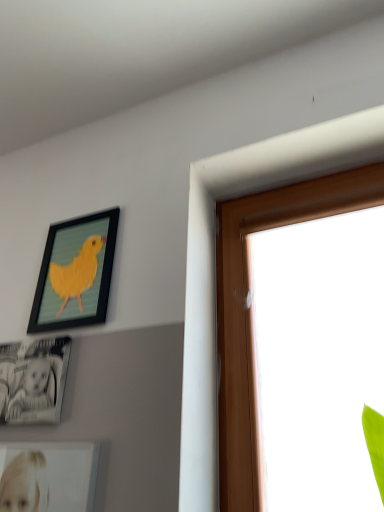
Question: Would you say black glossy photo frame at lower left, which ranks as the 2th picture frame in top-to-bottom order, is outside matte black picture frame at upper left, marked as the 2th picture frame in a bottom-to-top arrangement?

Choices:
 (A) no
 (B) yes

Answer: (B)

Question: Is black glossy photo frame at lower left, which appears as the first picture frame when ordered from the bottom, bigger than matte black picture frame at upper left, marked as the 2th picture frame in a bottom-to-top arrangement?

Choices:
 (A) yes
 (B) no

Answer: (B)

Question: Is black glossy photo frame at lower left, which ranks as the 2th picture frame in top-to-bottom order, taller than matte black picture frame at upper left, marked as the 2th picture frame in a bottom-to-top arrangement?

Choices:
 (A) yes
 (B) no

Answer: (B)

Question: Does black glossy photo frame at lower left, which ranks as the 2th picture frame in top-to-bottom order, appear on the left side of matte black picture frame at upper left, marked as the 2th picture frame in a bottom-to-top arrangement?

Choices:
 (A) no
 (B) yes

Answer: (B)

Question: Is black glossy photo frame at lower left, which ranks as the 2th picture frame in top-to-bottom order, closer to camera compared to matte black picture frame at upper left, the 1th picture frame in the top-to-bottom sequence?

Choices:
 (A) no
 (B) yes

Answer: (B)

Question: Could matte black picture frame at upper left, marked as the 2th picture frame in a bottom-to-top arrangement, be considered to be inside black glossy photo frame at lower left, which ranks as the 2th picture frame in top-to-bottom order?

Choices:
 (A) yes
 (B) no

Answer: (B)

Question: Does matte black picture frame at upper left, the 1th picture frame in the top-to-bottom sequence, have a greater height compared to black glossy photo frame at lower left, which ranks as the 2th picture frame in top-to-bottom order?

Choices:
 (A) no
 (B) yes

Answer: (B)

Question: Is matte black picture frame at upper left, marked as the 2th picture frame in a bottom-to-top arrangement, to the left of black glossy photo frame at lower left, which ranks as the 2th picture frame in top-to-bottom order, from the viewer's perspective?

Choices:
 (A) no
 (B) yes

Answer: (A)

Question: Is matte black picture frame at upper left, the 1th picture frame in the top-to-bottom sequence, thinner than black glossy photo frame at lower left, which appears as the first picture frame when ordered from the bottom?

Choices:
 (A) no
 (B) yes

Answer: (B)

Question: From the image's perspective, is matte black picture frame at upper left, marked as the 2th picture frame in a bottom-to-top arrangement, under black glossy photo frame at lower left, which appears as the first picture frame when ordered from the bottom?

Choices:
 (A) yes
 (B) no

Answer: (B)

Question: Considering the relative sizes of matte black picture frame at upper left, the 1th picture frame in the top-to-bottom sequence, and black glossy photo frame at lower left, which appears as the first picture frame when ordered from the bottom, in the image provided, is matte black picture frame at upper left, the 1th picture frame in the top-to-bottom sequence, bigger than black glossy photo frame at lower left, which appears as the first picture frame when ordered from the bottom,?

Choices:
 (A) yes
 (B) no

Answer: (A)

Question: Is matte black picture frame at upper left, the 1th picture frame in the top-to-bottom sequence, shorter than black glossy photo frame at lower left, which appears as the first picture frame when ordered from the bottom?

Choices:
 (A) yes
 (B) no

Answer: (B)

Question: Do you think black glossy photo frame at lower left, which appears as the first picture frame when ordered from the bottom, is within matte black picture frame at upper left, the 1th picture frame in the top-to-bottom sequence, or outside of it?

Choices:
 (A) outside
 (B) inside

Answer: (A)